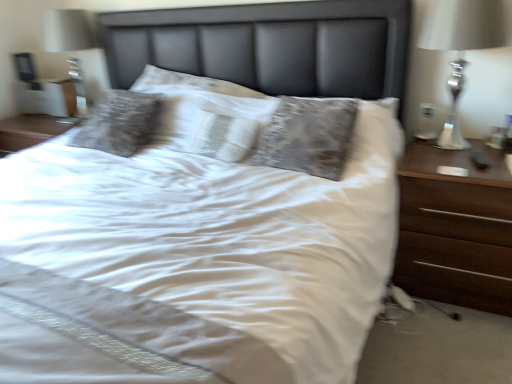
Question: From the image's perspective, is silver metallic lamp at right under white textured pillow at center?

Choices:
 (A) no
 (B) yes

Answer: (A)

Question: From a real-world perspective, is silver metallic lamp at right located beneath white textured pillow at center?

Choices:
 (A) yes
 (B) no

Answer: (B)

Question: Considering the relative sizes of silver metallic lamp at right and white textured pillow at center in the image provided, is silver metallic lamp at right thinner than white textured pillow at center?

Choices:
 (A) yes
 (B) no

Answer: (B)

Question: Can you confirm if silver metallic lamp at right is shorter than white textured pillow at center?

Choices:
 (A) yes
 (B) no

Answer: (B)

Question: Is silver metallic lamp at right taller than white textured pillow at center?

Choices:
 (A) yes
 (B) no

Answer: (A)

Question: From the image's perspective, is dark wood nightstand at right located above or below white textured pillow at center?

Choices:
 (A) below
 (B) above

Answer: (A)

Question: Is point (489, 284) closer or farther from the camera than point (243, 150)?

Choices:
 (A) farther
 (B) closer

Answer: (B)

Question: From their relative heights in the image, would you say dark wood nightstand at right is taller or shorter than white textured pillow at center?

Choices:
 (A) tall
 (B) short

Answer: (A)

Question: From a real-world perspective, is dark wood nightstand at right positioned above or below white textured pillow at center?

Choices:
 (A) above
 (B) below

Answer: (B)

Question: From the image's perspective, relative to silver metallic lamp at right, is dark wood nightstand at right above or below?

Choices:
 (A) above
 (B) below

Answer: (B)

Question: Considering the positions of point (478, 188) and point (454, 142), is point (478, 188) closer or farther from the camera than point (454, 142)?

Choices:
 (A) farther
 (B) closer

Answer: (B)

Question: From a real-world perspective, relative to silver metallic lamp at right, is dark wood nightstand at right vertically above or below?

Choices:
 (A) above
 (B) below

Answer: (B)

Question: In the image, is dark wood nightstand at right positioned in front of or behind silver metallic lamp at right?

Choices:
 (A) front
 (B) behind

Answer: (A)

Question: Looking at their shapes, would you say silver metallic lamp at right is wider or thinner than white textured pillow at center?

Choices:
 (A) thin
 (B) wide

Answer: (B)

Question: From the image's perspective, is silver metallic lamp at right located above or below white textured pillow at center?

Choices:
 (A) above
 (B) below

Answer: (A)